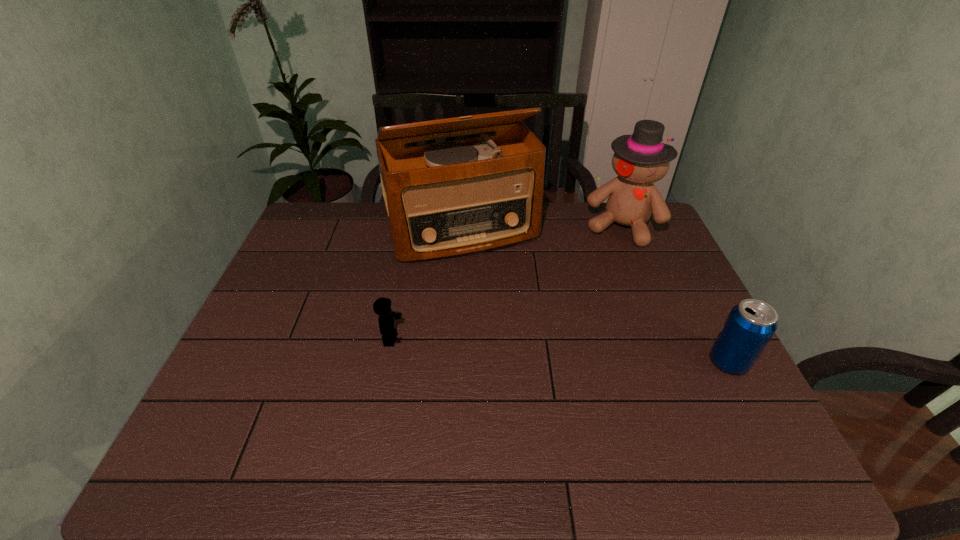
Find the location of a particular element. vacant space in between the second tallest object and the pop soda is located at coordinates (675, 294).

Where is `free space that is in between the tallest object and the second tallest object`? free space that is in between the tallest object and the second tallest object is located at coordinates (541, 229).

Where is `free area in between the radio receiver and the rag_doll`? This screenshot has height=540, width=960. free area in between the radio receiver and the rag_doll is located at coordinates (541, 229).

Locate which object ranks second in proximity to the tallest object. Please provide its 2D coordinates. Your answer should be formatted as a tuple, i.e. [(x, y)], where the tuple contains the x and y coordinates of a point satisfying the conditions above.

[(382, 306)]

Locate which object is the closest to the third shortest object. Please provide its 2D coordinates. Your answer should be formatted as a tuple, i.e. [(x, y)], where the tuple contains the x and y coordinates of a point satisfying the conditions above.

[(448, 199)]

Locate an element on the screen. This screenshot has width=960, height=540. blank area in the image that satisfies the following two spatial constraints: 1. on the front side of the third tallest object; 2. on the right side of the rag_doll is located at coordinates (676, 362).

You are a GUI agent. You are given a task and a screenshot of the screen. Output one action in this format:
    pyautogui.click(x=<x>, y=<y>)
    Task: Click on the vacant space that satisfies the following two spatial constraints: 1. on the back side of the radio receiver; 2. on the right side of the third shortest object
    
    Given the screenshot: What is the action you would take?
    pyautogui.click(x=463, y=226)